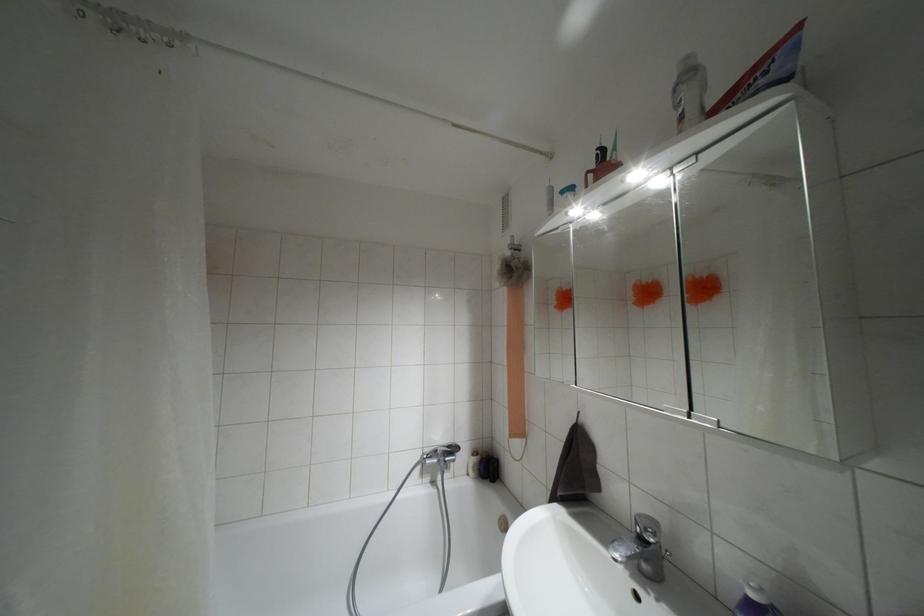
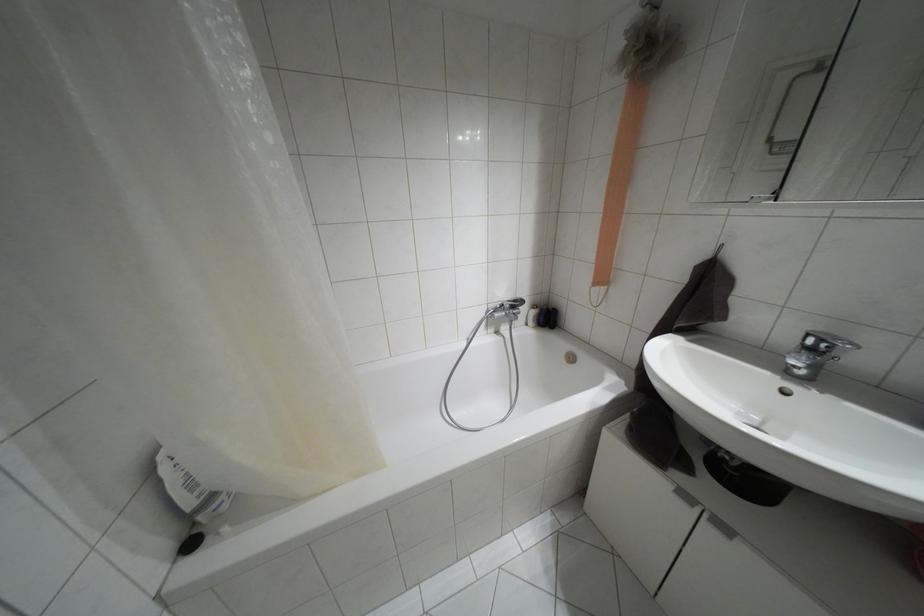
In the second image, find the point that corresponds to the point at 447,446 in the first image.

(514, 301)